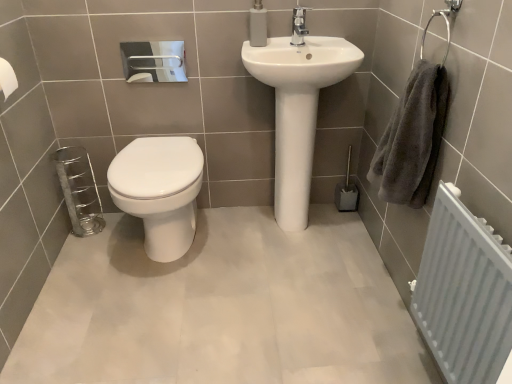
You are a GUI agent. You are given a task and a screenshot of the screen. Output one action in this format:
    pyautogui.click(x=<x>, y=<y>)
    Task: Click on the free point above white glossy toilet at center (from a real-world perspective)
    
    Given the screenshot: What is the action you would take?
    pyautogui.click(x=155, y=149)